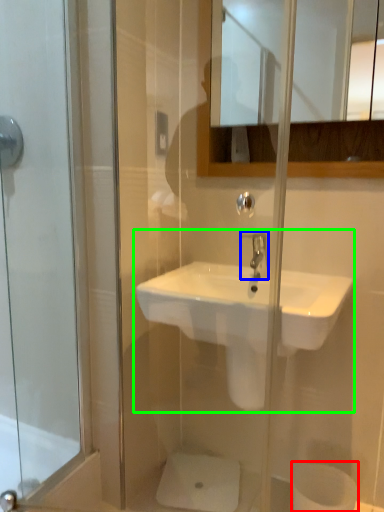
Question: Considering the real-world distances, which object is farthest from toilet paper (highlighted by a red box)? tap (highlighted by a blue box) or sink (highlighted by a green box)?

Choices:
 (A) tap
 (B) sink

Answer: (A)